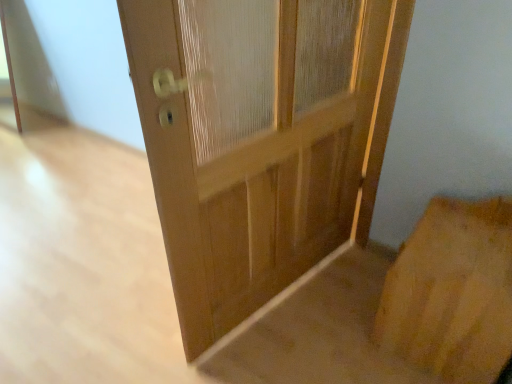
What is the approximate height of brown cardboard at lower right?

20.69 inches.

What do you see at coordinates (452, 292) in the screenshot? I see `brown cardboard at lower right` at bounding box center [452, 292].

Locate an element on the screen. The width and height of the screenshot is (512, 384). brown cardboard at lower right is located at coordinates (452, 292).

Image resolution: width=512 pixels, height=384 pixels. I want to click on natural wood door at center, so click(260, 138).

This screenshot has width=512, height=384. Describe the element at coordinates (260, 138) in the screenshot. I see `natural wood door at center` at that location.

The height and width of the screenshot is (384, 512). What are the coordinates of `brown cardboard at lower right` in the screenshot? It's located at (452, 292).

Between natural wood door at center and brown cardboard at lower right, which one appears on the left side from the viewer's perspective?

natural wood door at center.

Considering the positions of objects natural wood door at center and brown cardboard at lower right in the image provided, who is in front, natural wood door at center or brown cardboard at lower right?

natural wood door at center is closer to the camera.

Considering the points (338, 40) and (484, 308), which point is behind, point (338, 40) or point (484, 308)?

Positioned behind is point (338, 40).

From the image's perspective, is natural wood door at center above or below brown cardboard at lower right?

From the image's perspective, natural wood door at center appears above brown cardboard at lower right.

From a real-world perspective, relative to brown cardboard at lower right, is natural wood door at center vertically above or below?

natural wood door at center is situated higher than brown cardboard at lower right in the real world.

Considering the sizes of objects natural wood door at center and brown cardboard at lower right in the image provided, who is wider, natural wood door at center or brown cardboard at lower right?

Wider between the two is brown cardboard at lower right.

Can you confirm if natural wood door at center is shorter than brown cardboard at lower right?

No.

Considering the relative sizes of natural wood door at center and brown cardboard at lower right in the image provided, is natural wood door at center bigger than brown cardboard at lower right?

Yes.

Looking at this image, is natural wood door at center not within brown cardboard at lower right?

Absolutely, natural wood door at center is external to brown cardboard at lower right.

Are natural wood door at center and brown cardboard at lower right located far from each other?

natural wood door at center is near brown cardboard at lower right, not far away.

Is natural wood door at center oriented towards brown cardboard at lower right?

No, natural wood door at center is not aimed at brown cardboard at lower right.

The height and width of the screenshot is (384, 512). In order to click on door on the left of brown cardboard at lower right in this screenshot , I will do `click(260, 138)`.

Consider the image. Which is more to the left, brown cardboard at lower right or natural wood door at center?

natural wood door at center is more to the left.

Considering the relative positions of brown cardboard at lower right and natural wood door at center in the image provided, is brown cardboard at lower right behind natural wood door at center?

Yes, brown cardboard at lower right is further from the viewer.

Is point (469, 200) positioned after point (209, 169)?

Yes, point (469, 200) is behind point (209, 169).

From the image's perspective, between brown cardboard at lower right and natural wood door at center, who is located below?

brown cardboard at lower right appears lower in the image.

From a real-world perspective, does brown cardboard at lower right sit lower than natural wood door at center?

Indeed, from a real-world perspective, brown cardboard at lower right is positioned beneath natural wood door at center.

From the picture: Considering the sizes of objects brown cardboard at lower right and natural wood door at center in the image provided, who is wider, brown cardboard at lower right or natural wood door at center?

brown cardboard at lower right.

Who is shorter, brown cardboard at lower right or natural wood door at center?

With less height is brown cardboard at lower right.

Considering the relative sizes of brown cardboard at lower right and natural wood door at center in the image provided, is brown cardboard at lower right bigger than natural wood door at center?

No, brown cardboard at lower right is not bigger than natural wood door at center.

Choose the correct answer: Is brown cardboard at lower right inside natural wood door at center or outside it?

brown cardboard at lower right is spatially situated outside natural wood door at center.

Would you say brown cardboard at lower right is a long distance from natural wood door at center?

No, brown cardboard at lower right is not far from natural wood door at center.

Does brown cardboard at lower right turn towards natural wood door at center?

Yes, brown cardboard at lower right is aimed at natural wood door at center.

How much distance is there between brown cardboard at lower right and natural wood door at center?

brown cardboard at lower right is 21.43 inches from natural wood door at center.

The width and height of the screenshot is (512, 384). I want to click on door lying on the left of brown cardboard at lower right, so [260, 138].

This screenshot has height=384, width=512. I want to click on cardboard box to the right of natural wood door at center, so click(452, 292).

Where is `door on the left of brown cardboard at lower right`? door on the left of brown cardboard at lower right is located at coordinates (260, 138).